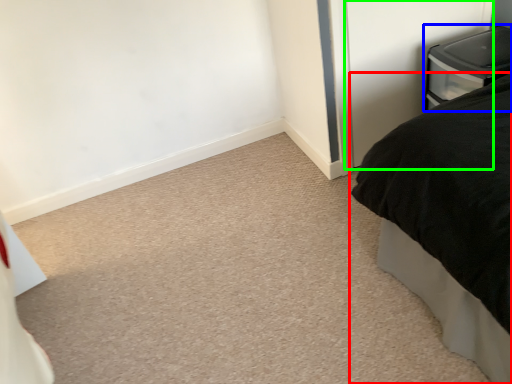
Question: Which is farther away from bed (highlighted by a red box)? furniture (highlighted by a blue box) or screen door (highlighted by a green box)?

Choices:
 (A) furniture
 (B) screen door

Answer: (B)